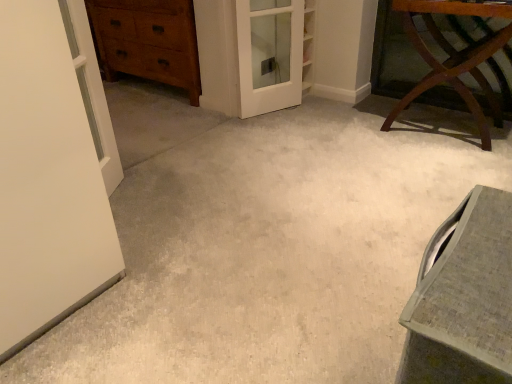
Measure the distance between matte gray vanity at lower right and camera.

The distance of matte gray vanity at lower right from camera is 48.40 centimeters.

The image size is (512, 384). What do you see at coordinates (454, 56) in the screenshot? I see `mahogany wood table at upper right` at bounding box center [454, 56].

The width and height of the screenshot is (512, 384). In order to click on matte gray vanity at lower right in this screenshot , I will do `click(463, 298)`.

In terms of width, does white glass screen door at center look wider or thinner when compared to white glossy door at upper left?

white glass screen door at center is wider than white glossy door at upper left.

Which is more to the left, white glass screen door at center or white glossy door at upper left?

From the viewer's perspective, white glossy door at upper left appears more on the left side.

From the image's perspective, which one is positioned higher, white glass screen door at center or white glossy door at upper left?

From the image's view, white glass screen door at center is above.

Identify the location of screen door above the white glossy door at upper left (from the image's perspective). (269, 54).

Considering the relative positions of wooden chest of drawers at upper left and white glass screen door at center in the image provided, is wooden chest of drawers at upper left to the left of white glass screen door at center from the viewer's perspective?

Yes, wooden chest of drawers at upper left is to the left of white glass screen door at center.

Which is in front, wooden chest of drawers at upper left or white glass screen door at center?

white glass screen door at center is closer to the camera.

Considering the sizes of objects wooden chest of drawers at upper left and white glass screen door at center in the image provided, who is shorter, wooden chest of drawers at upper left or white glass screen door at center?

white glass screen door at center.

Looking at this image, is wooden chest of drawers at upper left positioned far away from white glass screen door at center?

No.

Considering the sizes of objects matte gray vanity at lower right and white glossy door at upper left in the image provided, who is shorter, matte gray vanity at lower right or white glossy door at upper left?

matte gray vanity at lower right.

Between matte gray vanity at lower right and white glossy door at upper left, which one appears on the left side from the viewer's perspective?

white glossy door at upper left is more to the left.

Which is nearer, [436,355] or [103,100]?

Point [436,355]

In the scene shown: From the image's perspective, is matte gray vanity at lower right over white glossy door at upper left?

No, from the image's perspective, matte gray vanity at lower right is not over white glossy door at upper left.

Can you confirm if matte gray vanity at lower right is positioned to the right of mahogany wood table at upper right?

In fact, matte gray vanity at lower right is to the left of mahogany wood table at upper right.

From the picture: How many degrees apart are the facing directions of matte gray vanity at lower right and mahogany wood table at upper right?

There is a 93.3-degree angle between the facing directions of matte gray vanity at lower right and mahogany wood table at upper right.

How much distance is there between matte gray vanity at lower right and mahogany wood table at upper right?

They are 1.79 meters apart.

From a real-world perspective, between matte gray vanity at lower right and mahogany wood table at upper right, who is vertically higher?

From a 3D spatial view, mahogany wood table at upper right is above.

From the image's perspective, is white glass screen door at center above mahogany wood table at upper right?

Yes.

In the scene shown: Are white glass screen door at center and mahogany wood table at upper right located far from each other?

white glass screen door at center is actually quite close to mahogany wood table at upper right.

In terms of height, does white glass screen door at center look taller or shorter compared to mahogany wood table at upper right?

Considering their sizes, white glass screen door at center has less height than mahogany wood table at upper right.

How different are the orientations of white glass screen door at center and mahogany wood table at upper right in degrees?

The angle between the facing direction of white glass screen door at center and the facing direction of mahogany wood table at upper right is 64.7 degrees.

Is point (92, 39) farther from camera compared to point (495, 100)?

That is True.

Which object is further away from the camera, white glossy door at upper left or mahogany wood table at upper right?

mahogany wood table at upper right is further from the camera.

Is mahogany wood table at upper right inside white glossy door at upper left?

No, mahogany wood table at upper right is not surrounded by white glossy door at upper left.

Considering the relative sizes of white glossy door at upper left and mahogany wood table at upper right in the image provided, is white glossy door at upper left shorter than mahogany wood table at upper right?

No.

Who is smaller, mahogany wood table at upper right or wooden chest of drawers at upper left?

mahogany wood table at upper right is smaller.

Which is closer, (456, 84) or (190, 104)?

The point (456, 84) is in front.

Does mahogany wood table at upper right turn towards wooden chest of drawers at upper left?

No, mahogany wood table at upper right is not aimed at wooden chest of drawers at upper left.

The height and width of the screenshot is (384, 512). In the image, there is a white glossy door at upper left. Identify the location of screen door above it (from the image's perspective). (269, 54).

Identify the location of the chest of drawers that is behind the white glass screen door at center. (148, 41).

Considering their positions, is white glass screen door at center positioned closer to white glossy door at upper left than wooden chest of drawers at upper left?

Based on the image, white glass screen door at center appears to be nearer to white glossy door at upper left.

When comparing their distances from matte gray vanity at lower right, does mahogany wood table at upper right or wooden chest of drawers at upper left seem further?

wooden chest of drawers at upper left.

Which object lies further to the anchor point white glossy door at upper left, wooden chest of drawers at upper left or matte gray vanity at lower right?

The object further to white glossy door at upper left is wooden chest of drawers at upper left.

Which object lies nearer to the anchor point mahogany wood table at upper right, white glass screen door at center or matte gray vanity at lower right?

white glass screen door at center.

Which object lies nearer to the anchor point mahogany wood table at upper right, matte gray vanity at lower right or white glossy door at upper left?

Among the two, white glossy door at upper left is located nearer to mahogany wood table at upper right.

Considering their positions, is matte gray vanity at lower right positioned closer to white glass screen door at center than white glossy door at upper left?

Based on the image, white glossy door at upper left appears to be nearer to white glass screen door at center.

Looking at the image, which one is located closer to matte gray vanity at lower right, wooden chest of drawers at upper left or white glossy door at upper left?

white glossy door at upper left.

Looking at the image, which one is located further to white glossy door at upper left, white glass screen door at center or mahogany wood table at upper right?

Based on the image, mahogany wood table at upper right appears to be further to white glossy door at upper left.

The height and width of the screenshot is (384, 512). Identify the location of vanity between white glossy door at upper left and mahogany wood table at upper right. (463, 298).

At what (x,y) coordinates should I click in order to perform the action: click on door between matte gray vanity at lower right and white glass screen door at center along the z-axis. Please return your answer as a coordinate pair (x, y). This screenshot has width=512, height=384. Looking at the image, I should click on (92, 90).

Identify the location of screen door between white glossy door at upper left and mahogany wood table at upper right in the horizontal direction. (269, 54).

The image size is (512, 384). I want to click on chest of drawers between white glossy door at upper left and mahogany wood table at upper right from left to right, so 148,41.